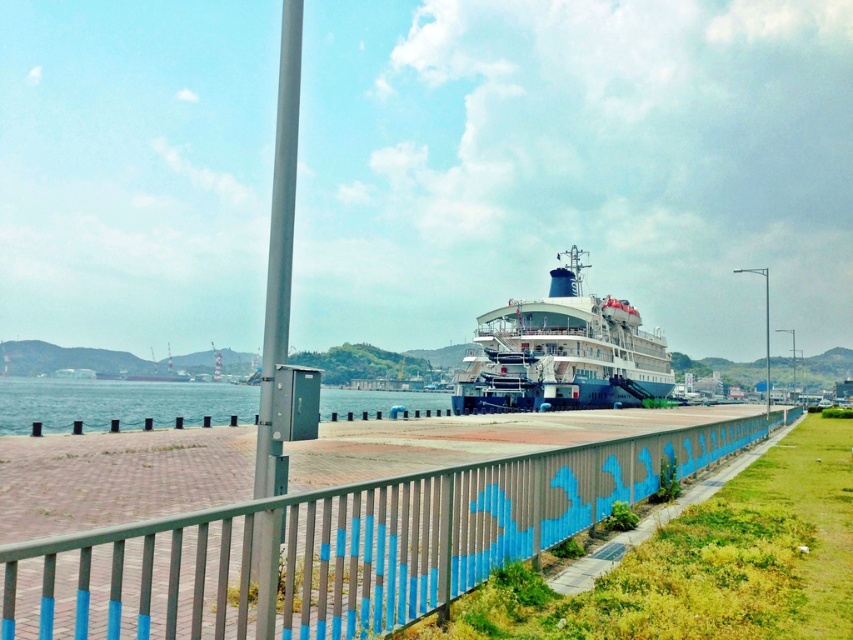
You are standing on the paved walkway in the waterfront scene. You notice a point marked at coordinates (x=337, y=545). Based on the scene description, what object is located at this point?

The point at coordinates (x=337, y=545) corresponds to the metallic blue fence at center.

You are standing at the center of the walkway and want to take a photo of the white glossy cruise ship at center. In which direction should you move to get the best view of it?

You should move towards the center of the walkway to get the best view of the white glossy cruise ship at center, as it is located at point (561,353).

You are standing on the waterfront and want to take a photo of the metallic blue fence at center and the clear water at lower left. Which object should you focus on first to ensure both are in sharp focus?

The metallic blue fence at center is closer to the viewer than the clear water at lower left. To ensure both are in sharp focus, you should focus on the metallic blue fence at center first, as it is closer, and the clear water at lower left will naturally fall within the depth of field if focused properly on the closer object.